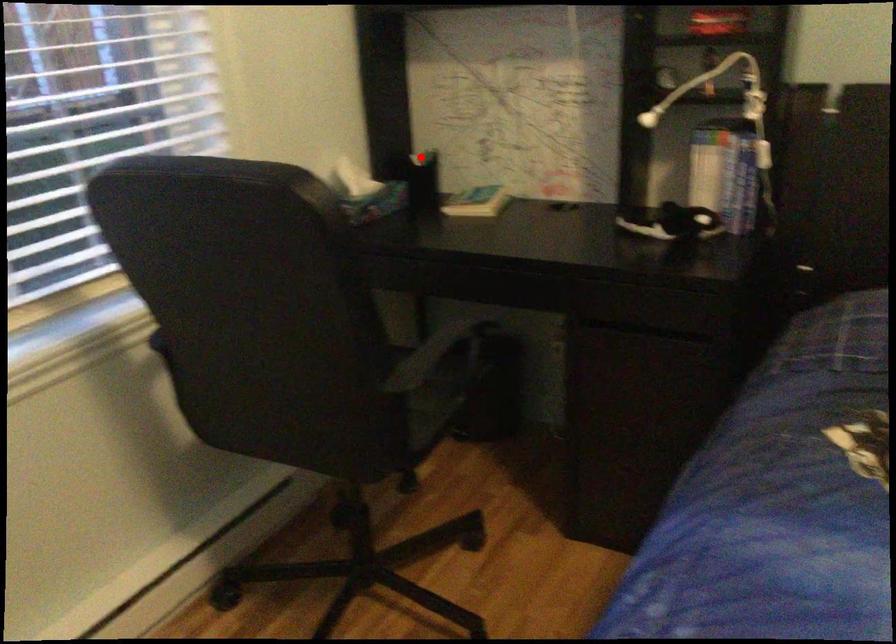
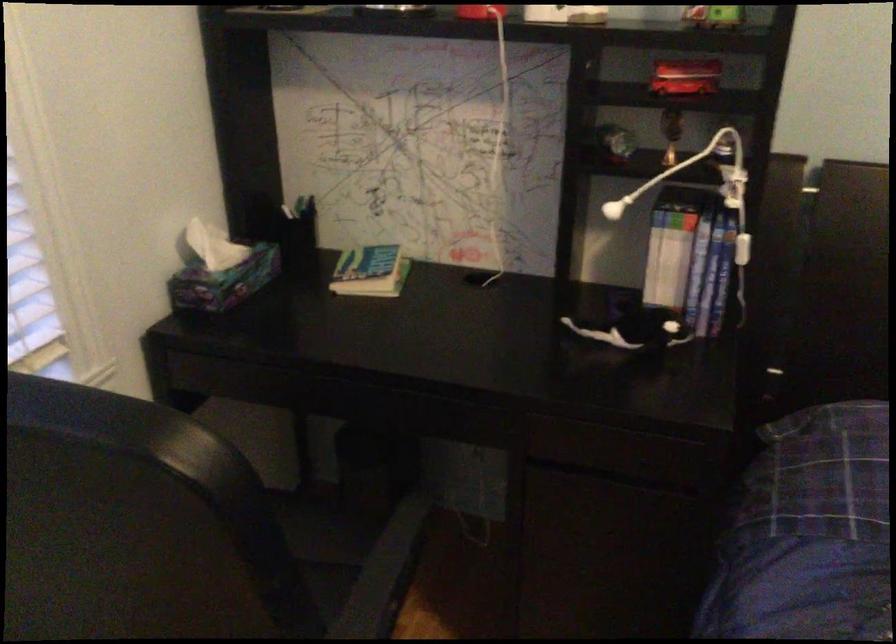
Question: I am providing you with two images of the same scene from different viewpoints. Given a red point in image1, look at the same physical point in image2. Is it:

Choices:
 (A) Closer to the viewpoint
 (B) Farther from the viewpoint

Answer: (A)